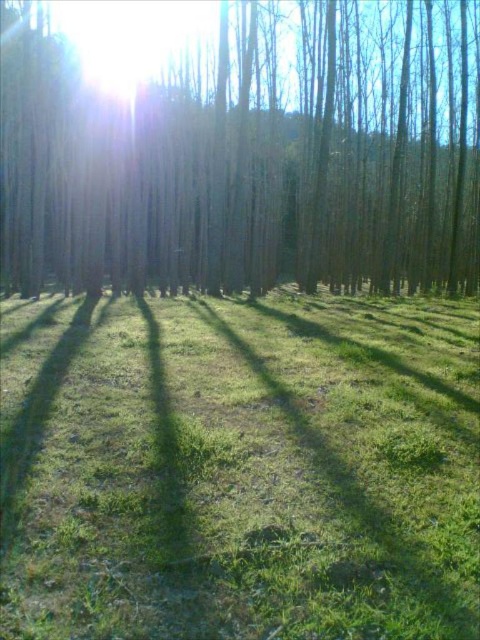
Does green grassy at center come in front of brown smooth tree at center?

Yes, it is in front of brown smooth tree at center.

Between point (238, 406) and point (98, 140), which one is positioned behind?

The point (98, 140) is behind.

This screenshot has width=480, height=640. In order to click on green grassy at center in this screenshot , I will do `click(240, 468)`.